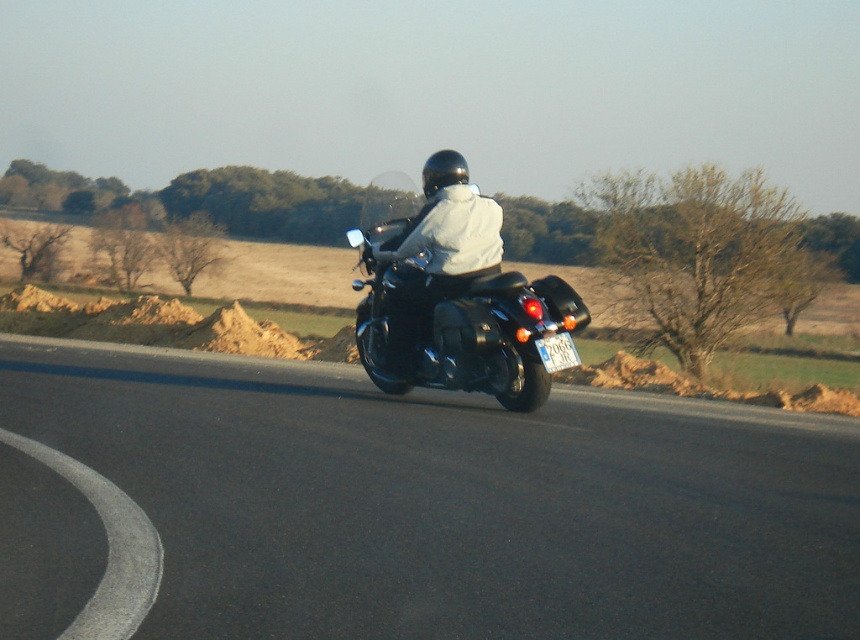
You are a GPS device guiding a delivery driver. The driver needs to turn left at the next intersection, but the motorcycle at point (455, 300) is blocking the path. Can the driver safely navigate around the motorcycle to make the left turn?

The black matte motorcycle at center is located at point (455, 300). Since the motorcycle is at the center of the road, the driver may need to wait until the motorcycle moves forward before attempting the left turn to ensure safe passage.

You are a pedestrian standing on the side of the road. You see the black asphalt road at center and the black matte motorcycle at center. Which object is closer to you?

The black asphalt road at center is closer to the viewer than the black matte motorcycle at center.

You are a delivery driver on a motorcycle with a 2.5 meter turning radius. You need to navigate a curve on the black asphalt road at center. Can your motorcycle make the turn without drifting off the road?

The distance between the motorcycle and the black asphalt road at center is 4.65 meters. Since the turning radius of the motorcycle is 2.5 meters, which is less than half the road width, the turn can be made safely without drifting off the road.